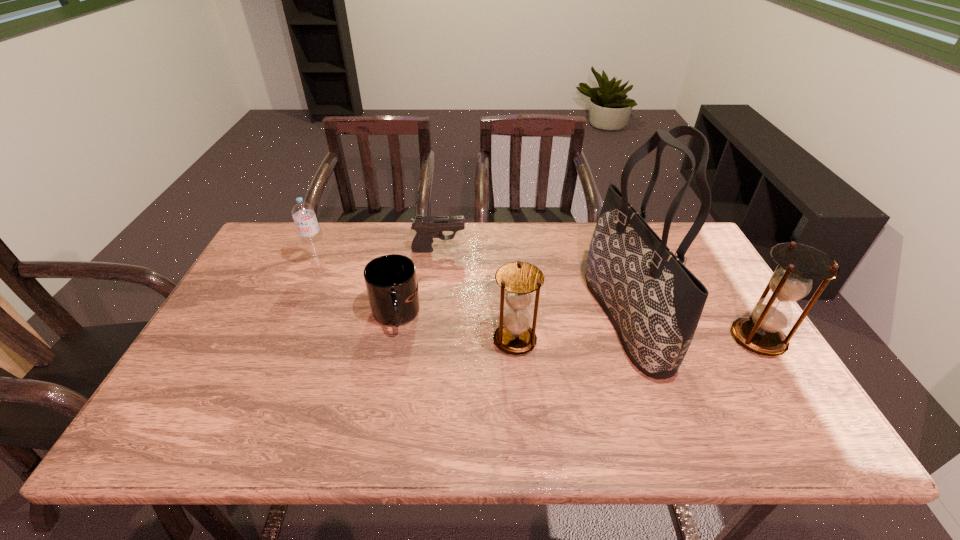
Please show where to add a hourglass on the left while keeping spacing even. Please provide its 2D coordinates. Your answer should be formatted as a tuple, i.e. [(x, y)], where the tuple contains the x and y coordinates of a point satisfying the conditions above.

[(270, 342)]